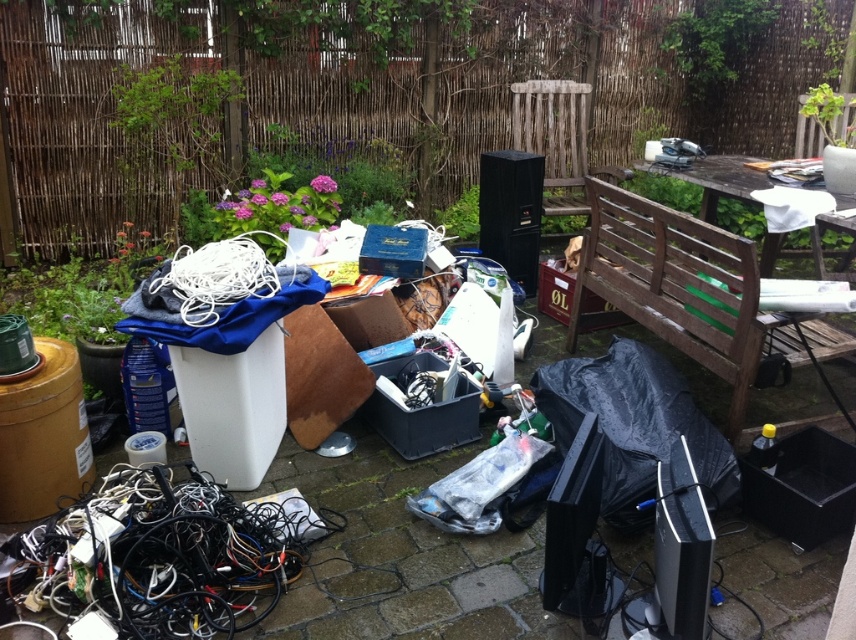
Who is higher up, brown wooden bench at upper right or wooden bench at upper right?

wooden bench at upper right is above.

Based on the photo, which is more to the right, brown wooden bench at upper right or wooden bench at upper right?

→ wooden bench at upper right is more to the right.

Locate an element on the screen. brown wooden bench at upper right is located at coordinates (685, 289).

I want to click on brown wooden bench at upper right, so click(685, 289).

Is point (188, 522) positioned behind point (764, 259)?

No, it is not.

Is black rubber wires at lower left smaller than wooden bench at upper right?

Indeed, black rubber wires at lower left has a smaller size compared to wooden bench at upper right.

Which is in front, point (221, 554) or point (740, 176)?

Point (221, 554) is in front.

Find the location of a particular element. The image size is (856, 640). black rubber wires at lower left is located at coordinates (170, 554).

Which of these two, black rubber wires at lower left or brown wooden bench at upper right, stands shorter?

black rubber wires at lower left

Is point (217, 513) positioned in front of point (752, 362)?

Yes, it is in front of point (752, 362).

Locate an element on the screen. black rubber wires at lower left is located at coordinates (170, 554).